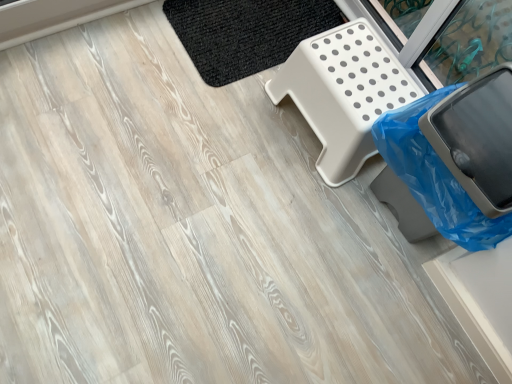
Where is `blank space above white plastic step stool at upper right (from a real-world perspective)`? blank space above white plastic step stool at upper right (from a real-world perspective) is located at coordinates (355, 90).